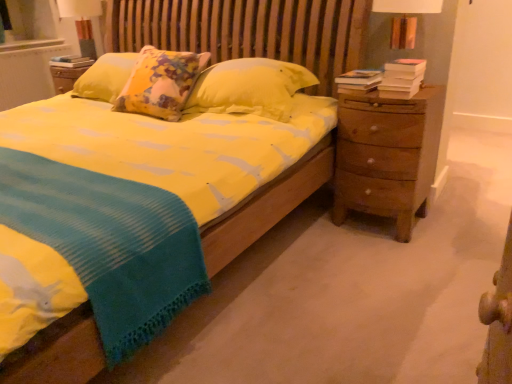
Question: Considering the positions of hardcover book at upper left, acting as the third book starting from the front, and white textured radiator at upper left in the image, is hardcover book at upper left, acting as the third book starting from the front, wider or thinner than white textured radiator at upper left?

Choices:
 (A) wide
 (B) thin

Answer: (A)

Question: In terms of height, does hardcover book at upper left, which appears as the first book when viewed from the left, look taller or shorter compared to white textured radiator at upper left?

Choices:
 (A) tall
 (B) short

Answer: (B)

Question: Which of these objects is positioned closest to the hardcover books at right, the second book when ordered from right to left?

Choices:
 (A) hardcover book at upper left, which is the third book in right-to-left order
 (B) matte white lampshade at upper left
 (C) white textured radiator at upper left
 (D) brown wooden nightstand at right
 (E) hardcover book at right, positioned as the first book in front-to-back order

Answer: (E)

Question: Which of these objects is positioned farthest from the matte white lampshade at upper left?

Choices:
 (A) hardcover book at upper left, acting as the third book starting from the front
 (B) yellow cotton bed at center
 (C) hardcover books at right, which is counted as the second book, starting from the front
 (D) brown wooden nightstand at right
 (E) hardcover book at right, marked as the third book in a left-to-right arrangement

Answer: (D)